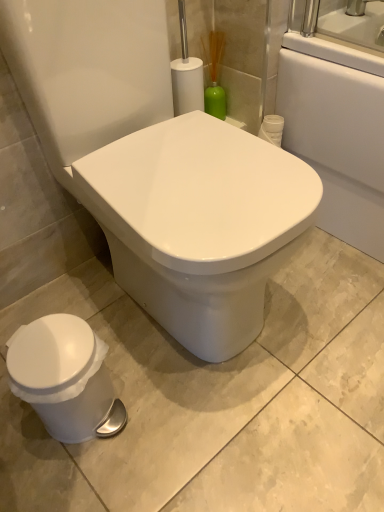
Locate an element on the screen. vacant space to the right of white plastic trash can at lower left is located at coordinates (160, 409).